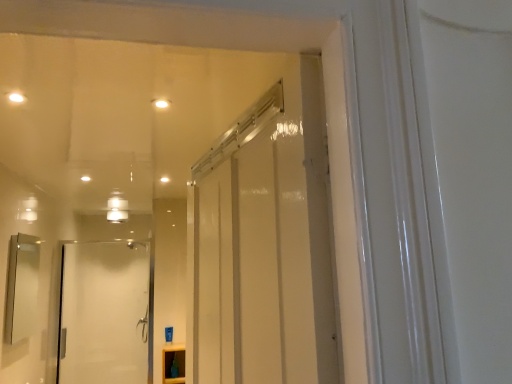
Question: Is matte silver mirror at left bigger or smaller than matte white cabinet at lower center?

Choices:
 (A) small
 (B) big

Answer: (B)

Question: Does point (7, 289) appear closer or farther from the camera than point (182, 380)?

Choices:
 (A) farther
 (B) closer

Answer: (B)

Question: Which is nearer to the matte silver mirror at left?

Choices:
 (A) white glass door at left
 (B) matte white cabinet at lower center

Answer: (B)

Question: Estimate the real-world distances between objects in this image. Which object is farther from the matte silver mirror at left?

Choices:
 (A) white glass door at left
 (B) matte white cabinet at lower center

Answer: (A)